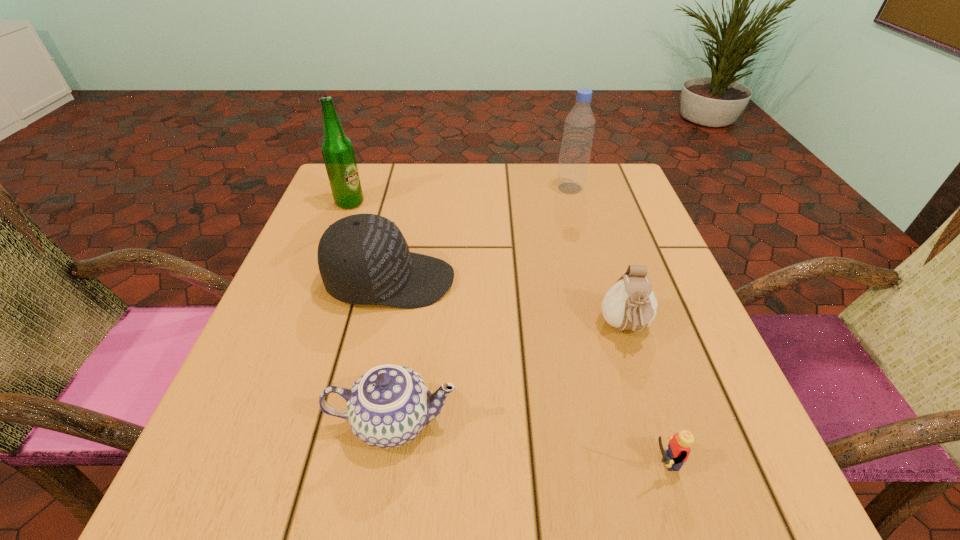
This screenshot has width=960, height=540. I want to click on beer bottle, so click(x=337, y=149).

At what (x,y) coordinates should I click in order to perform the action: click on bottle. Please return your answer as a coordinate pair (x, y). Image resolution: width=960 pixels, height=540 pixels. Looking at the image, I should click on (579, 126).

This screenshot has height=540, width=960. I want to click on baseball cap, so click(364, 259).

Identify the location of pouch. (630, 304).

Locate an element on the screen. chinaware is located at coordinates (388, 406).

Find the location of a particular element. Lego is located at coordinates (678, 451).

What are the coordinates of `free region located on the label of the beer bottle` in the screenshot? It's located at (406, 203).

Find the location of a particular element. The height and width of the screenshot is (540, 960). vacant space located on the front of the bottle is located at coordinates (578, 218).

Identify the location of free region located 0.180m at the front of the baseball cap where the brim is located. (547, 281).

I want to click on vacant space located 0.060m on the front-facing side of the pouch, so click(643, 384).